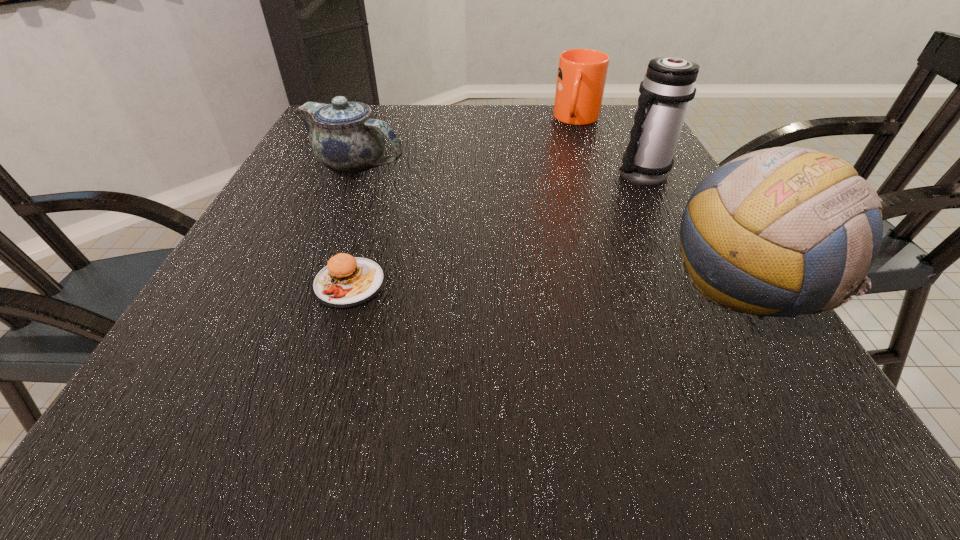
Identify the location of patty. Image resolution: width=960 pixels, height=540 pixels. (347, 281).

Locate an element on the screen. This screenshot has width=960, height=540. volleyball is located at coordinates (791, 224).

You are a GUI agent. You are given a task and a screenshot of the screen. Output one action in this format:
    pyautogui.click(x=<x>, y=<y>)
    Task: Click on the farthest object
    
    Given the screenshot: What is the action you would take?
    pyautogui.click(x=581, y=77)

This screenshot has width=960, height=540. In order to click on chinaware in this screenshot , I will do `click(344, 136)`.

Locate an element on the screen. This screenshot has height=540, width=960. thermos bottle is located at coordinates (668, 87).

This screenshot has height=540, width=960. I want to click on vacant area situated 0.210m on the back of the patty, so click(x=376, y=197).

Image resolution: width=960 pixels, height=540 pixels. Find the location of `free point located 0.150m on the left of the volleyball`. free point located 0.150m on the left of the volleyball is located at coordinates (578, 286).

Where is `blank area located 0.300m on the handle side of the mug`? blank area located 0.300m on the handle side of the mug is located at coordinates (564, 192).

Identify the location of vacant area located 0.090m on the handle side of the mug. (573, 148).

The image size is (960, 540). What are the coordinates of `vacant point located on the handle side of the mug` in the screenshot? It's located at (566, 180).